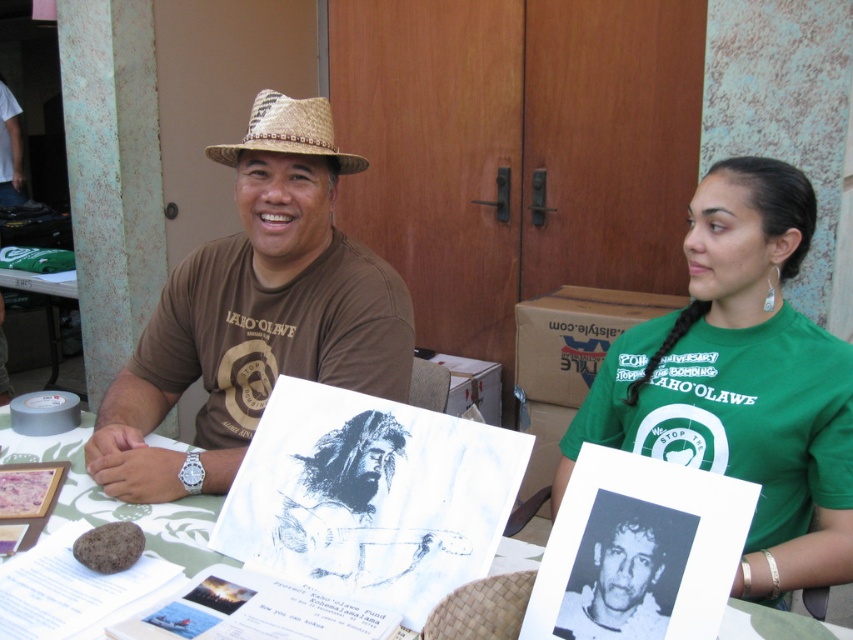
Question: Which point is farther to the camera?

Choices:
 (A) white paper at center
 (B) brown straw hat at center
 (C) green fabric shirt at upper right
 (D) black paper at center

Answer: (B)

Question: Which of the following is the farthest from the observer?

Choices:
 (A) green fabric shirt at upper right
 (B) white paper at center

Answer: (A)

Question: Can you confirm if white paper at center is thinner than black paper at center?

Choices:
 (A) yes
 (B) no

Answer: (B)

Question: Can you confirm if brown straw hat at center is positioned to the left of black paper at center?

Choices:
 (A) no
 (B) yes

Answer: (B)

Question: Which object appears farthest from the camera in this image?

Choices:
 (A) brown straw hat at center
 (B) black paper at center
 (C) green fabric shirt at upper right

Answer: (A)

Question: Is white paper at center above straw woven hat at upper center?

Choices:
 (A) no
 (B) yes

Answer: (A)